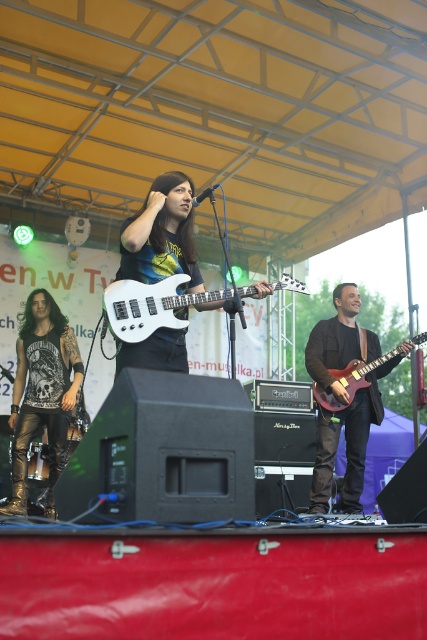
Question: Which point is farther to the camera?

Choices:
 (A) shiny gold pants at center
 (B) matte black guitar at center

Answer: (A)

Question: Which point appears closest to the camera in this image?

Choices:
 (A) (350, 381)
 (B) (55, 468)
 (C) (161, 230)

Answer: (C)

Question: Can you confirm if white glossy electric guitar at center is smaller than glossy wood guitar at right?

Choices:
 (A) no
 (B) yes

Answer: (A)

Question: Can you confirm if shiny brown leather jacket at center is smaller than shiny gold pants at center?

Choices:
 (A) yes
 (B) no

Answer: (B)

Question: Is white glossy electric guitar at center bigger than glossy wood guitar at right?

Choices:
 (A) yes
 (B) no

Answer: (A)

Question: Which object appears closest to the camera in this image?

Choices:
 (A) white glossy electric guitar at center
 (B) glossy wood guitar at right
 (C) matte black guitar at center
 (D) shiny gold pants at center

Answer: (C)